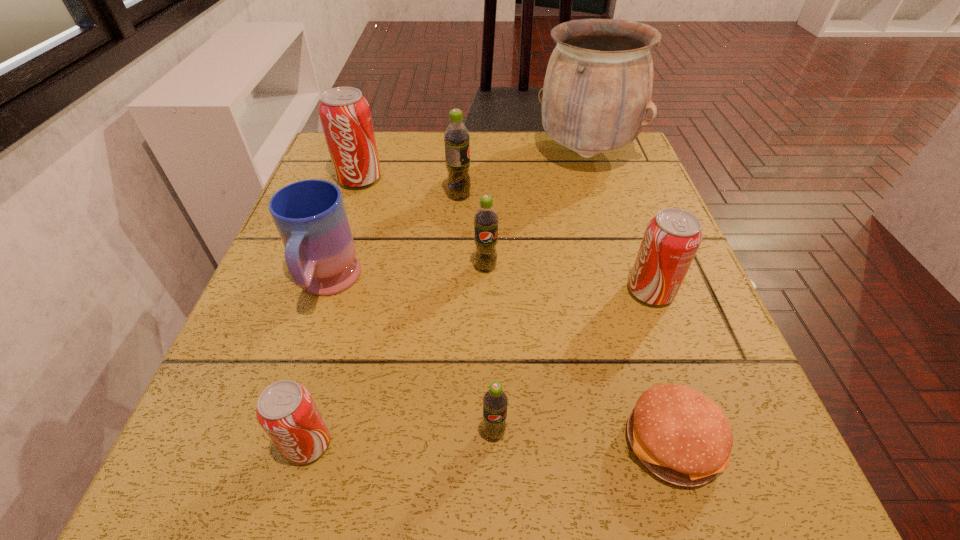
This screenshot has height=540, width=960. In order to click on vacant space located on the back of the hamburger in this screenshot , I will do `click(618, 269)`.

This screenshot has height=540, width=960. What are the coordinates of `urn that is positioned at the far edge` in the screenshot? It's located at (598, 85).

Locate an element on the screen. This screenshot has height=540, width=960. soda can located in the far edge section of the desktop is located at coordinates (345, 115).

Where is `hamburger that is at the near edge`? The width and height of the screenshot is (960, 540). hamburger that is at the near edge is located at coordinates (682, 436).

Find the location of `mug situated at the left edge`. mug situated at the left edge is located at coordinates (310, 216).

This screenshot has height=540, width=960. I want to click on urn that is at the right edge, so click(x=598, y=85).

Locate an element on the screen. The width and height of the screenshot is (960, 540). soda can that is positioned at the right edge is located at coordinates (671, 239).

Image resolution: width=960 pixels, height=540 pixels. In order to click on hamburger present at the right edge in this screenshot , I will do `click(682, 436)`.

Where is `object present at the far left corner`? object present at the far left corner is located at coordinates (345, 115).

Identify the location of object present at the near left corner. (286, 411).